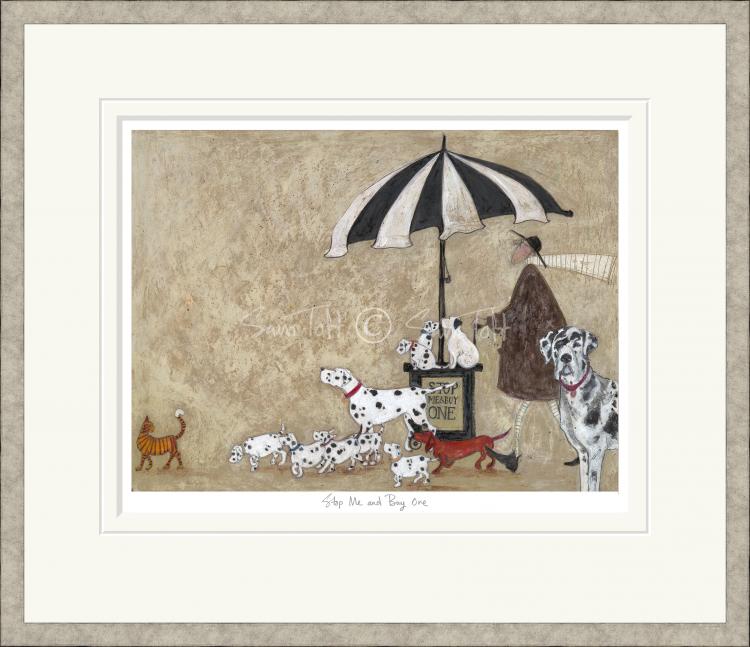
Locate an element on the screen. text board is located at coordinates (465, 398).